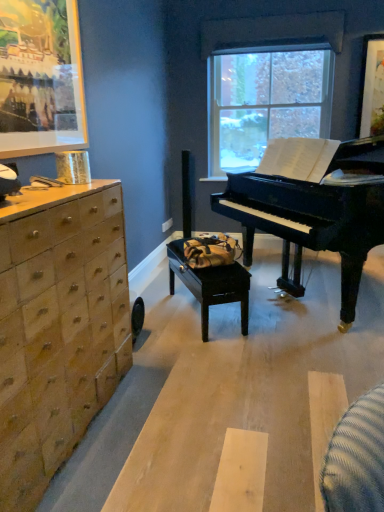
Find the location of a particular element. The height and width of the screenshot is (512, 384). free location in front of black wood table at center is located at coordinates (228, 359).